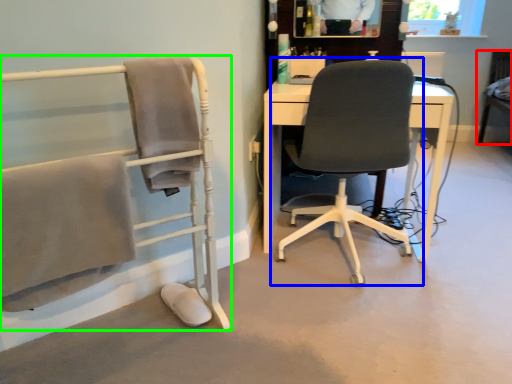
Question: Which object is the closest to the chair (highlighted by a red box)? Choose among these: chair (highlighted by a blue box) or chair (highlighted by a green box).

Choices:
 (A) chair
 (B) chair

Answer: (A)